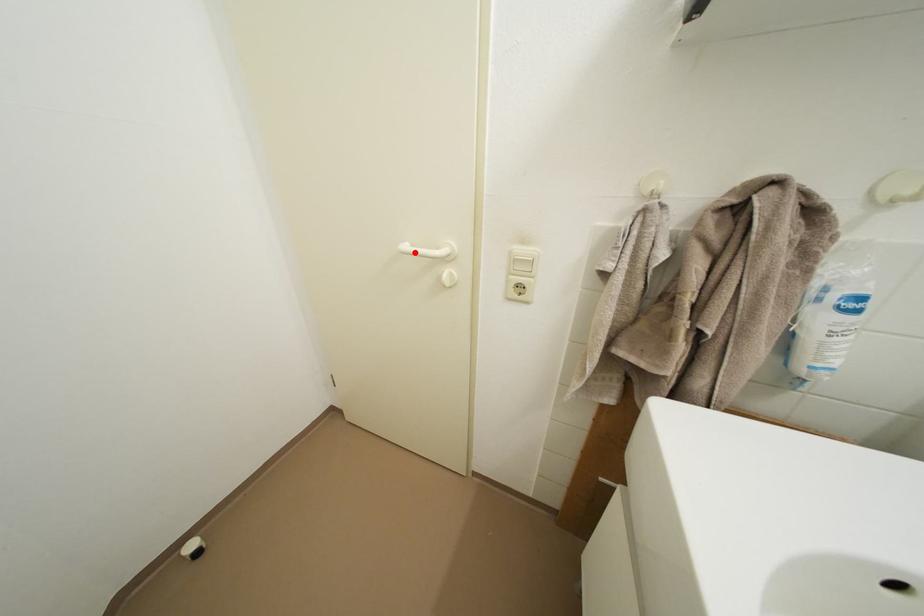
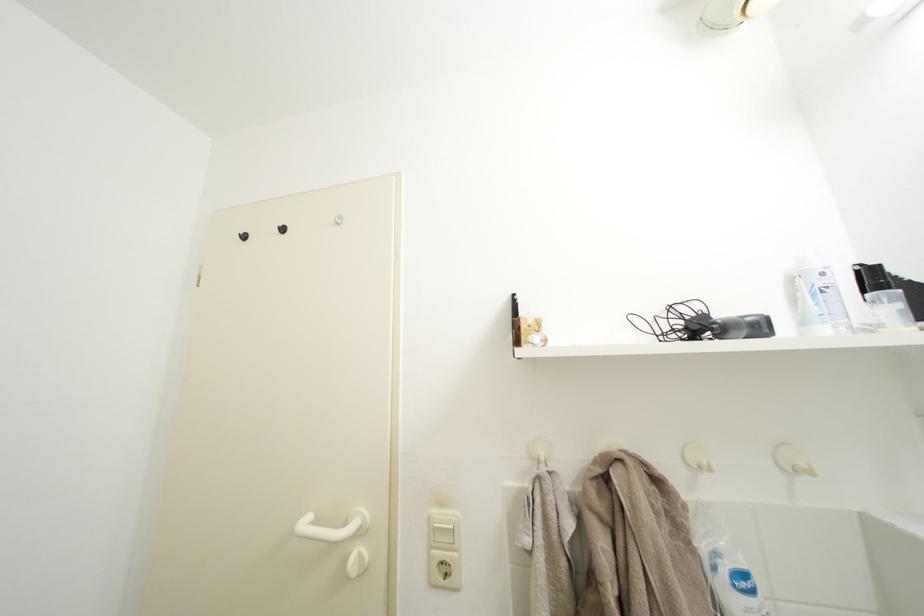
Question: I am providing you with two images of the same scene from different viewpoints. A red point is marked on the first image. At the location where the point appears in image 1, is it still visible in image 2?

Choices:
 (A) Yes
 (B) No

Answer: (A)